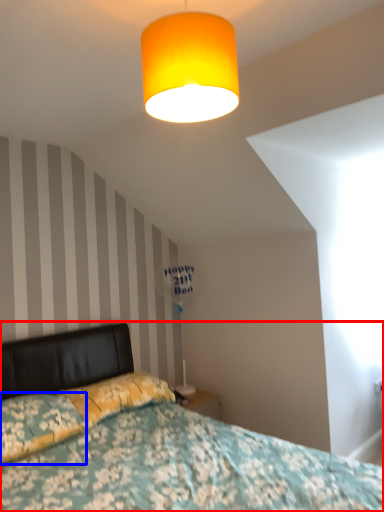
Question: Which object is further to the camera taking this photo, bed (highlighted by a red box) or pillow (highlighted by a blue box)?

Choices:
 (A) bed
 (B) pillow

Answer: (B)